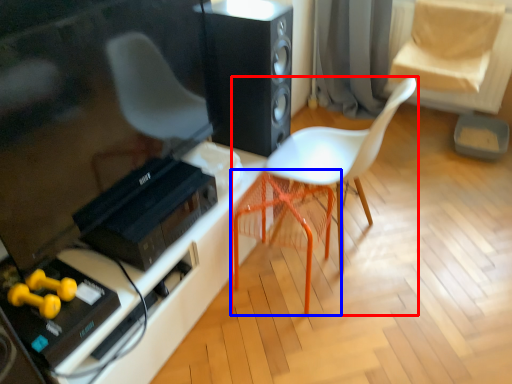
Question: Which object appears closest to the camera in this image, chair (highlighted by a red box) or swivel chair (highlighted by a blue box)?

Choices:
 (A) chair
 (B) swivel chair

Answer: (A)